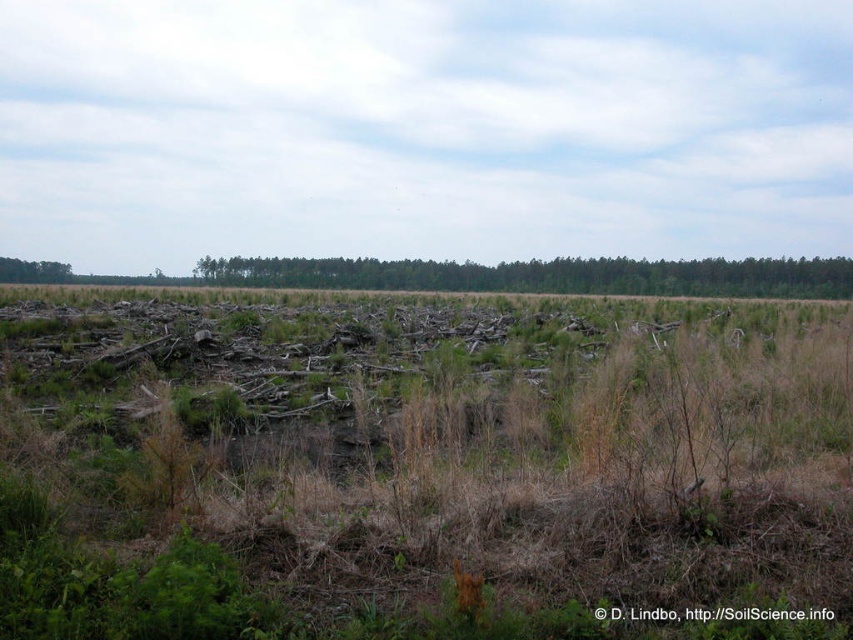
Question: Among these points, which one is farthest from the camera?

Choices:
 (A) (399, 259)
 (B) (12, 262)

Answer: (A)

Question: Among these objects, which one is nearest to the camera?

Choices:
 (A) green leafy tree at upper left
 (B) green leafy trees at center

Answer: (B)

Question: Is green leafy trees at center smaller than green leafy tree at upper left?

Choices:
 (A) no
 (B) yes

Answer: (A)

Question: Can you confirm if green leafy trees at center is wider than green leafy tree at upper left?

Choices:
 (A) yes
 (B) no

Answer: (A)

Question: Does green leafy trees at center have a smaller size compared to green leafy tree at upper left?

Choices:
 (A) yes
 (B) no

Answer: (B)